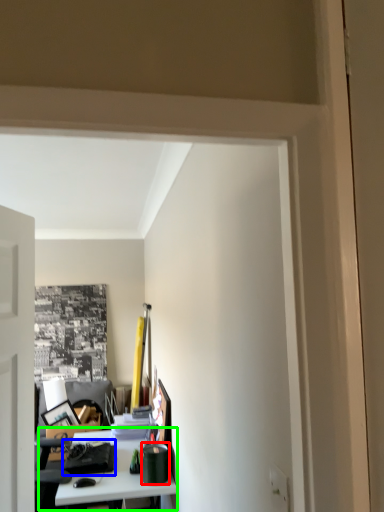
Question: Which is nearer to the stationery (highlighted by a red box)? stationery (highlighted by a blue box) or table (highlighted by a green box).

Choices:
 (A) stationery
 (B) table

Answer: (B)